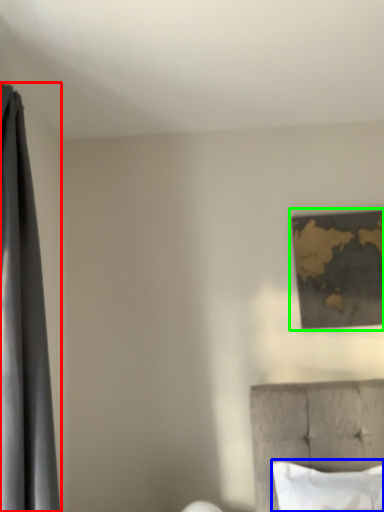
Question: Based on their relative distances, which object is nearer to curtain (highlighted by a red box)? Choose from pillow (highlighted by a blue box) and picture frame (highlighted by a green box).

Choices:
 (A) pillow
 (B) picture frame

Answer: (A)